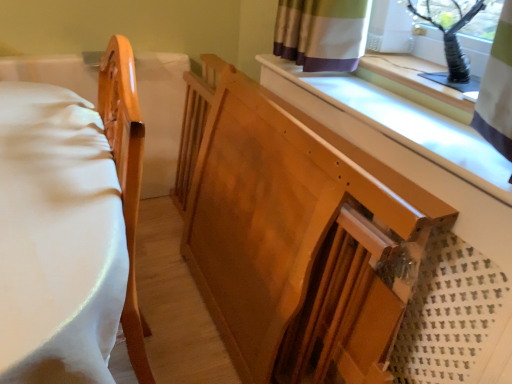
Question: Is wooden changing table at center not within black plastic vase at upper right?

Choices:
 (A) yes
 (B) no

Answer: (A)

Question: Is wooden changing table at center bigger than black plastic vase at upper right?

Choices:
 (A) no
 (B) yes

Answer: (B)

Question: Does wooden changing table at center have a greater width compared to black plastic vase at upper right?

Choices:
 (A) yes
 (B) no

Answer: (A)

Question: Could you tell me if wooden changing table at center is turned towards black plastic vase at upper right?

Choices:
 (A) no
 (B) yes

Answer: (A)

Question: From a real-world perspective, is wooden changing table at center positioned over black plastic vase at upper right based on gravity?

Choices:
 (A) yes
 (B) no

Answer: (B)

Question: Is wooden changing table at center behind black plastic vase at upper right?

Choices:
 (A) no
 (B) yes

Answer: (A)

Question: Is black plastic vase at upper right beside matte wood bed frame at left?

Choices:
 (A) no
 (B) yes

Answer: (A)

Question: Is matte wood bed frame at left completely or partially inside black plastic vase at upper right?

Choices:
 (A) no
 (B) yes

Answer: (A)

Question: From a real-world perspective, is black plastic vase at upper right under matte wood bed frame at left?

Choices:
 (A) no
 (B) yes

Answer: (A)

Question: Is black plastic vase at upper right looking in the opposite direction of matte wood bed frame at left?

Choices:
 (A) no
 (B) yes

Answer: (A)

Question: Is black plastic vase at upper right to the right of matte wood bed frame at left from the viewer's perspective?

Choices:
 (A) yes
 (B) no

Answer: (A)

Question: Considering the relative sizes of black plastic vase at upper right and matte wood bed frame at left in the image provided, is black plastic vase at upper right taller than matte wood bed frame at left?

Choices:
 (A) yes
 (B) no

Answer: (B)

Question: Could you tell me if wooden changing table at center is facing matte wood bed frame at left?

Choices:
 (A) yes
 (B) no

Answer: (A)